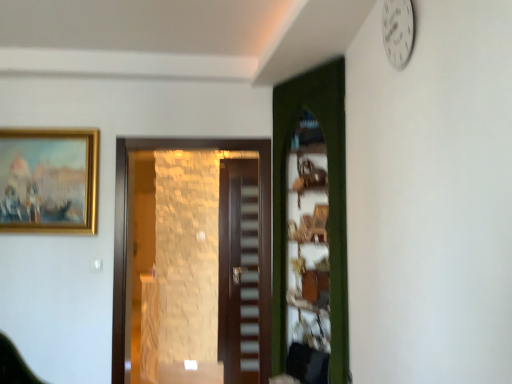
Locate an element on the screen. The width and height of the screenshot is (512, 384). green wooden door at center, the 1th door from the right is located at coordinates (329, 191).

Where is `white plastic clock at upper right`? white plastic clock at upper right is located at coordinates pos(398,31).

Where is `brown wooden door at center, which is the second door in left-to-right order`? This screenshot has height=384, width=512. brown wooden door at center, which is the second door in left-to-right order is located at coordinates (239, 271).

From the image's perspective, is brown wooden door at center, which is the second door in left-to-right order, above gold-framed painting at upper left?

No.

Choose the correct answer: Is brown wooden door at center, which is the 3th door in front-to-back order, inside gold-framed painting at upper left or outside it?

brown wooden door at center, which is the 3th door in front-to-back order, exists outside the volume of gold-framed painting at upper left.

Considering the sizes of objects brown wooden door at center, arranged as the 1th door when viewed from the back, and gold-framed painting at upper left in the image provided, who is bigger, brown wooden door at center, arranged as the 1th door when viewed from the back, or gold-framed painting at upper left?

brown wooden door at center, arranged as the 1th door when viewed from the back.

Find the location of a particular element. This screenshot has width=512, height=384. picture frame above the brown wooden door at center, which is the second door in left-to-right order (from the image's perspective) is located at coordinates (49, 180).

Is brown wooden door at center, which is the second door in left-to-right order, wider or thinner than dark wood stairwell at center?

brown wooden door at center, which is the second door in left-to-right order, is wider than dark wood stairwell at center.

From the image's perspective, is brown wooden door at center, which is the 3th door in front-to-back order, positioned above or below dark wood stairwell at center?

brown wooden door at center, which is the 3th door in front-to-back order, is situated lower than dark wood stairwell at center in the image.

Where is `stairwell above the brown wooden door at center, which is the 2th door in right-to-left order (from the image's perspective)`? This screenshot has height=384, width=512. stairwell above the brown wooden door at center, which is the 2th door in right-to-left order (from the image's perspective) is located at coordinates (249, 281).

Is brown wooden door at center, which is the 2th door in right-to-left order, looking in the opposite direction of dark wood stairwell at center?

Yes.

Is white plastic clock at upper right aimed at gold-framed painting at upper left?

No, white plastic clock at upper right does not turn towards gold-framed painting at upper left.

Is point (391, 62) behind point (51, 159)?

No, (391, 62) is in front of (51, 159).

In terms of size, does white plastic clock at upper right appear bigger or smaller than green wooden door at center, the third door in the back-to-front sequence?

In the image, white plastic clock at upper right appears to be smaller than green wooden door at center, the third door in the back-to-front sequence.

Measure the distance between white plastic clock at upper right and green wooden door at center, which is the 1th door from front to back.

The distance of white plastic clock at upper right from green wooden door at center, which is the 1th door from front to back, is 1.06 meters.

Is white plastic clock at upper right facing away from green wooden door at center, the 1th door from the right?

No.

Between gold-framed painting at upper left and dark wood stairwell at center, which one has more height?

With more height is dark wood stairwell at center.

Which point is more distant from viewer, (x=96, y=199) or (x=256, y=323)?

The point (x=256, y=323) is more distant.

Can you confirm if gold-framed painting at upper left is thinner than dark wood stairwell at center?

Incorrect, the width of gold-framed painting at upper left is not less than that of dark wood stairwell at center.

From the image's perspective, is gold-framed painting at upper left located beneath dark wood stairwell at center?

Actually, gold-framed painting at upper left appears above dark wood stairwell at center in the image.

From a real-world perspective, is white plastic clock at upper right located beneath brown stone wall at center, the third door positioned from the right?

Actually, white plastic clock at upper right is physically above brown stone wall at center, the third door positioned from the right, in the real world.

From the image's perspective, is white plastic clock at upper right above brown stone wall at center, which is the second door from back to front?

Yes, from the image's perspective, white plastic clock at upper right is above brown stone wall at center, which is the second door from back to front.

Who is bigger, white plastic clock at upper right or brown stone wall at center, the third door positioned from the right?

brown stone wall at center, the third door positioned from the right.

Is white plastic clock at upper right surrounding brown stone wall at center, the second door from the front?

No.

In the scene shown: Is green wooden door at center, which is the 1th door from front to back, in front of or behind brown wooden door at center, arranged as the 1th door when viewed from the back, in the image?

Clearly, green wooden door at center, which is the 1th door from front to back, is in front of brown wooden door at center, arranged as the 1th door when viewed from the back.

Between green wooden door at center, which is the 1th door from front to back, and brown wooden door at center, which is the second door in left-to-right order, which one has larger width?

Wider between the two is green wooden door at center, which is the 1th door from front to back.

What's the angular difference between green wooden door at center, arranged as the 3th door when viewed from the left, and brown wooden door at center, arranged as the 1th door when viewed from the back,'s facing directions?

There is a 58.1-degree angle between the facing directions of green wooden door at center, arranged as the 3th door when viewed from the left, and brown wooden door at center, arranged as the 1th door when viewed from the back.

The height and width of the screenshot is (384, 512). I want to click on the 2nd door to the right of the gold-framed painting at upper left, counting from the anchor's position, so click(239, 271).

Locate an element on the screen. The width and height of the screenshot is (512, 384). the 1st door in front of the dark wood stairwell at center is located at coordinates (239, 271).

Which object lies further to the anchor point brown stone wall at center, the 1th door when ordered from left to right, white plastic clock at upper right or gold-framed painting at upper left?

white plastic clock at upper right is further to brown stone wall at center, the 1th door when ordered from left to right.

Based on their spatial positions, is gold-framed painting at upper left or brown stone wall at center, the second door from the front, closer to dark wood stairwell at center?

Based on the image, brown stone wall at center, the second door from the front, appears to be nearer to dark wood stairwell at center.

Estimate the real-world distances between objects in this image. Which object is closer to dark wood stairwell at center, gold-framed painting at upper left or white plastic clock at upper right?

Based on the image, gold-framed painting at upper left appears to be nearer to dark wood stairwell at center.

From the picture: Estimate the real-world distances between objects in this image. Which object is closer to gold-framed painting at upper left, brown wooden door at center, which is the second door in left-to-right order, or brown stone wall at center, the second door from the front?

brown stone wall at center, the second door from the front, lies closer to gold-framed painting at upper left than the other object.

Looking at the image, which one is located closer to gold-framed painting at upper left, dark wood stairwell at center or white plastic clock at upper right?

Among the two, dark wood stairwell at center is located nearer to gold-framed painting at upper left.

Based on their spatial positions, is white plastic clock at upper right or dark wood stairwell at center further from brown wooden door at center, arranged as the 1th door when viewed from the back?

Among the two, white plastic clock at upper right is located further to brown wooden door at center, arranged as the 1th door when viewed from the back.

Looking at this image, when comparing their distances from white plastic clock at upper right, does gold-framed painting at upper left or dark wood stairwell at center seem further?

Among the two, dark wood stairwell at center is located further to white plastic clock at upper right.

Considering their positions, is dark wood stairwell at center positioned further to gold-framed painting at upper left than brown stone wall at center, which is the second door from back to front?

The object further to gold-framed painting at upper left is dark wood stairwell at center.

The image size is (512, 384). In order to click on picture frame located between white plastic clock at upper right and dark wood stairwell at center in the depth direction in this screenshot , I will do `click(49, 180)`.

This screenshot has height=384, width=512. Find the location of `door between green wooden door at center, arranged as the 3th door when viewed from the left, and brown wooden door at center, arranged as the 1th door when viewed from the back, along the z-axis`. door between green wooden door at center, arranged as the 3th door when viewed from the left, and brown wooden door at center, arranged as the 1th door when viewed from the back, along the z-axis is located at coordinates (130, 231).

Locate an element on the screen. door between white plastic clock at upper right and brown stone wall at center, the second door from the front, along the z-axis is located at coordinates (329, 191).

Where is `stairwell between gold-framed painting at upper left and green wooden door at center, the 1th door from the right, in the horizontal direction`? stairwell between gold-framed painting at upper left and green wooden door at center, the 1th door from the right, in the horizontal direction is located at coordinates (249, 281).